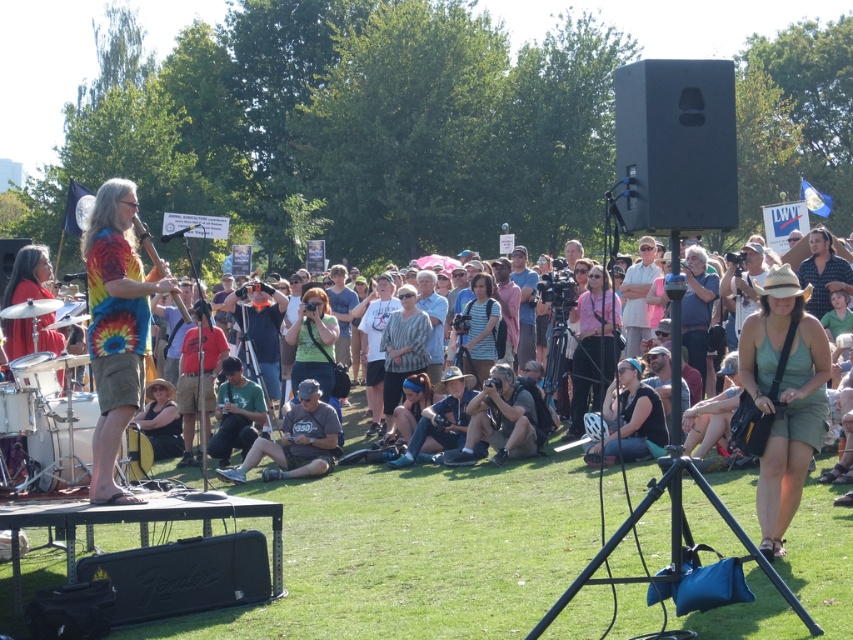
You are standing at the center of the park and want to reach the two points marked in the image. Which point, point [125,269] or point [596,458], is closer to you?

Point [125,269] is closer to the viewer than point [596,458], so you should go to point [125,269] first.

You are a photographer at the park event and want to capture both the green fabric dress at center and the gray cotton shirt at center in a single photo. Which clothing item should you focus on first to ensure both are in frame?

The green fabric dress at center is located above the gray cotton shirt at center, so you should focus on the gray cotton shirt at center first to ensure both are in frame.